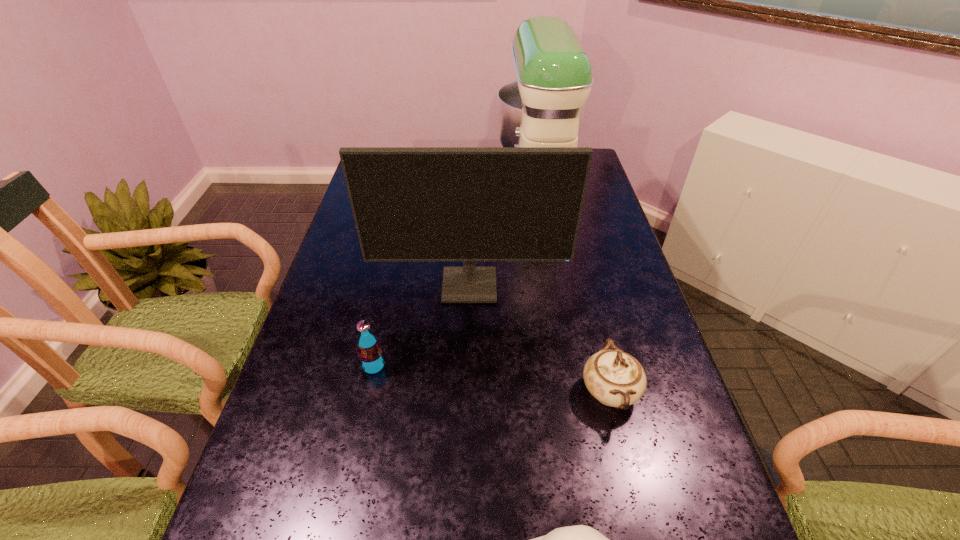
Locate an element on the screen. This screenshot has height=540, width=960. mixer is located at coordinates (545, 107).

Find the location of a particular element. computer monitor is located at coordinates (469, 204).

You are a GUI agent. You are given a task and a screenshot of the screen. Output one action in this format:
    pyautogui.click(x=<x>, y=<y>)
    Task: Click on the fourth shortest object
    The height and width of the screenshot is (540, 960).
    Given the screenshot: What is the action you would take?
    pyautogui.click(x=469, y=204)

I want to click on soda, so click(370, 355).

The height and width of the screenshot is (540, 960). In order to click on chinaware in this screenshot , I will do `click(615, 378)`.

Where is `vacant space situated on the controls of the mixer`? Image resolution: width=960 pixels, height=540 pixels. vacant space situated on the controls of the mixer is located at coordinates tap(444, 183).

Where is `vacant region located on the controls of the mixer`? Image resolution: width=960 pixels, height=540 pixels. vacant region located on the controls of the mixer is located at coordinates (476, 183).

This screenshot has height=540, width=960. I want to click on vacant space located 0.270m on the controls of the mixer, so click(421, 183).

Identify the location of vacant space located 0.210m on the front-facing side of the computer monitor. This screenshot has width=960, height=540. (468, 370).

Find the location of a particular element. This screenshot has width=960, height=540. free space located on the left of the soda is located at coordinates (337, 366).